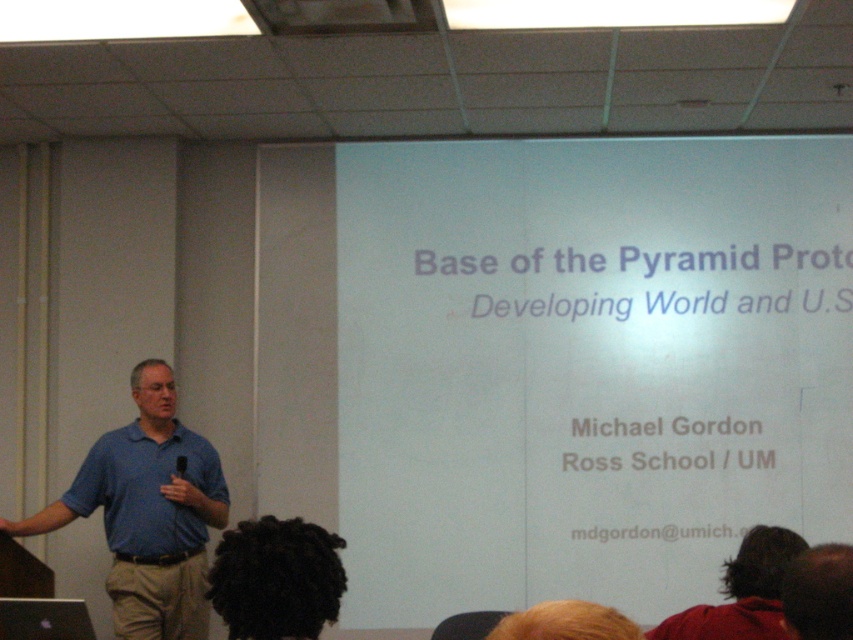
Based on the scene description, what object is located at the coordinates point (585, 365)?

The white matte projection screen at upper center is located at point (585, 365).

You are a photographer setting up for a presentation. You need to position your camera so that the white matte projection screen at upper center is in focus. If the camera has a depth of field of 4 meters, will the screen be in focus?

The distance between the white matte projection screen at upper center and the camera is 4.67 meters. Since the camera has a depth of field of 4 meters, the screen is slightly out of the depth of field range. Therefore, the screen may not be in focus.